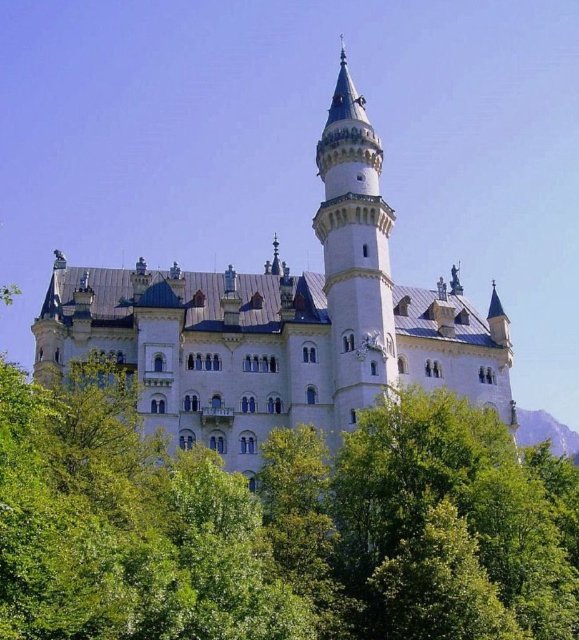
The width and height of the screenshot is (579, 640). What do you see at coordinates (283, 323) in the screenshot?
I see `white stone castle at center` at bounding box center [283, 323].

Can you confirm if white stone castle at center is positioned above white stone tower at center?

Incorrect, white stone castle at center is not positioned above white stone tower at center.

Which is in front, point (328, 269) or point (361, 296)?

Point (361, 296) is more forward.

Image resolution: width=579 pixels, height=640 pixels. What are the coordinates of `white stone castle at center` in the screenshot? It's located at (283, 323).

From the picture: Is white stone castle at center taller than green grassy hill at lower right?

Yes.

Is white stone castle at center shorter than green grassy hill at lower right?

Incorrect, white stone castle at center's height does not fall short of green grassy hill at lower right's.

What do you see at coordinates (283, 323) in the screenshot?
I see `white stone castle at center` at bounding box center [283, 323].

Find the location of a particular element. white stone castle at center is located at coordinates (283, 323).

Which is behind, point (335, 120) or point (573, 451)?

The point (573, 451) is behind.

Who is more distant from viewer, (340, 124) or (521, 419)?

The point (521, 419) is behind.

Identify the location of white stone tower at center. The image size is (579, 640). (354, 256).